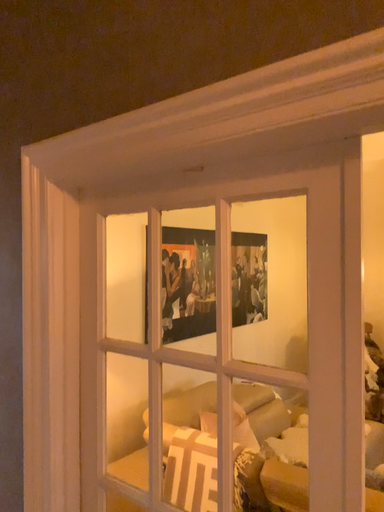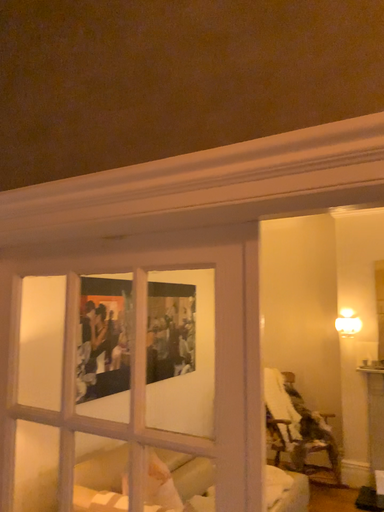
Question: How did the camera likely rotate when shooting the video?

Choices:
 (A) rotated left
 (B) rotated right

Answer: (B)